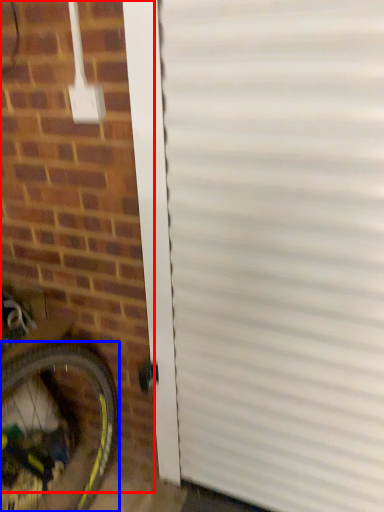
Question: Which object appears farthest to the camera in this image, brickwork (highlighted by a red box) or bicycle wheel (highlighted by a blue box)?

Choices:
 (A) brickwork
 (B) bicycle wheel

Answer: (B)